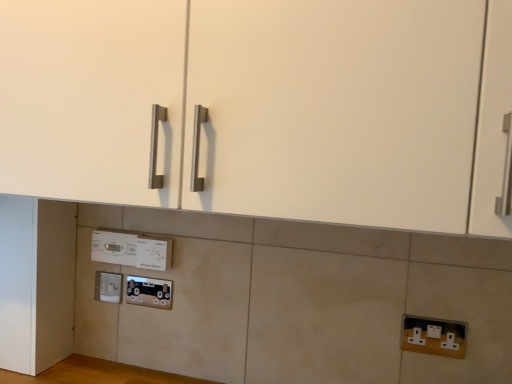
Question: Should I look upward or downward to see white matte door at lower left?

Choices:
 (A) down
 (B) up

Answer: (A)

Question: Is white plastic electric outlet at lower right, placed as the third electric outlet when sorted from back to front, outside of metallic socket at lower center?

Choices:
 (A) no
 (B) yes

Answer: (B)

Question: From a real-world perspective, does white plastic electric outlet at lower right, the 1th electric outlet from the right, sit lower than metallic socket at lower center?

Choices:
 (A) yes
 (B) no

Answer: (A)

Question: From the image's perspective, would you say white plastic electric outlet at lower right, the first electric outlet viewed from the front, is positioned over metallic socket at lower center?

Choices:
 (A) yes
 (B) no

Answer: (B)

Question: Is metallic socket at lower center surrounded by white plastic electric outlet at lower right, placed as the third electric outlet when sorted from back to front?

Choices:
 (A) no
 (B) yes

Answer: (A)

Question: Considering the relative sizes of white plastic electric outlet at lower right, the first electric outlet viewed from the front, and metallic socket at lower center in the image provided, is white plastic electric outlet at lower right, the first electric outlet viewed from the front, taller than metallic socket at lower center?

Choices:
 (A) no
 (B) yes

Answer: (B)

Question: Is white plastic electric outlet at lower right, positioned as the 3th electric outlet in left-to-right order, at the right side of metallic socket at lower center?

Choices:
 (A) yes
 (B) no

Answer: (A)

Question: Is white plastic thermostat at center further to the viewer compared to white plastic electric outlet at lower center, which is the second electric outlet from front to back?

Choices:
 (A) no
 (B) yes

Answer: (B)

Question: Is the depth of white plastic thermostat at center less than that of white plastic electric outlet at lower center, which is counted as the second electric outlet, starting from the right?

Choices:
 (A) no
 (B) yes

Answer: (A)

Question: Does white plastic thermostat at center have a lesser width compared to white plastic electric outlet at lower center, which is counted as the second electric outlet, starting from the right?

Choices:
 (A) no
 (B) yes

Answer: (B)

Question: Could you tell me if white plastic thermostat at center is facing white plastic electric outlet at lower center, which is the second electric outlet from front to back?

Choices:
 (A) no
 (B) yes

Answer: (A)

Question: Does white plastic thermostat at center have a larger size compared to white plastic electric outlet at lower center, acting as the 3th electric outlet starting from the bottom?

Choices:
 (A) yes
 (B) no

Answer: (A)

Question: From a real-world perspective, is white plastic thermostat at center below white plastic electric outlet at lower center, acting as the 3th electric outlet starting from the bottom?

Choices:
 (A) yes
 (B) no

Answer: (B)

Question: Is metallic socket at lower center beside white plastic thermostat at center?

Choices:
 (A) yes
 (B) no

Answer: (B)